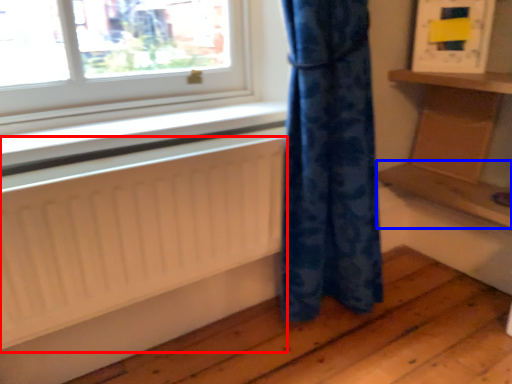
Question: Among these objects, which one is nearest to the camera, radiator (highlighted by a red box) or shelf (highlighted by a blue box)?

Choices:
 (A) radiator
 (B) shelf

Answer: (A)